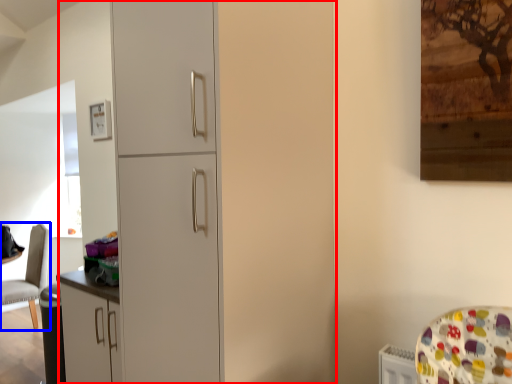
Question: Which point is further to the camera, dresser (highlighted by a red box) or chair (highlighted by a blue box)?

Choices:
 (A) dresser
 (B) chair

Answer: (B)